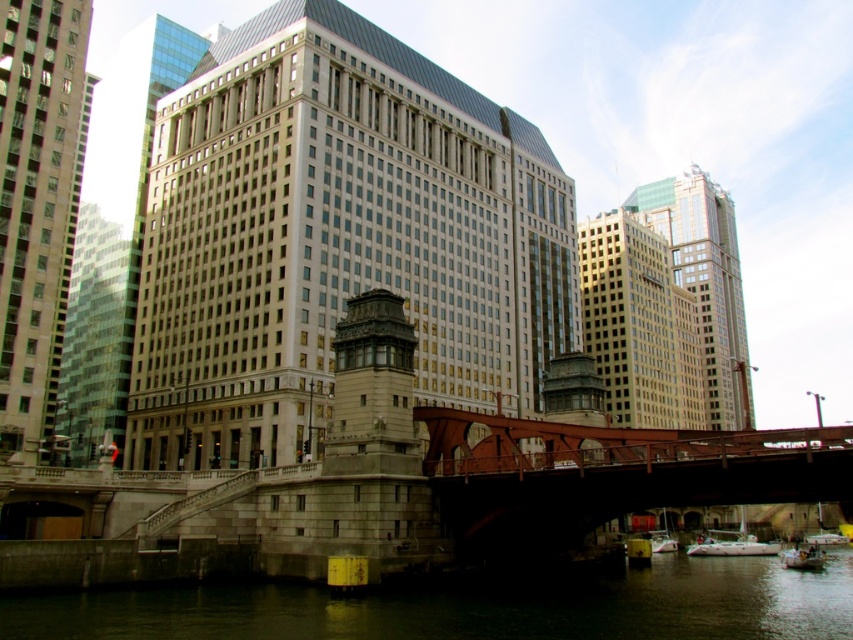
Question: Estimate the real-world distances between objects in this image. Which object is farther from the beige glass skyscraper at center?

Choices:
 (A) gold glass building at center-right
 (B) white plastic boat at lower right

Answer: (A)

Question: Can you confirm if greenish concrete water at lower center is positioned below white plastic boat at lower right?

Choices:
 (A) no
 (B) yes

Answer: (A)

Question: Which point is closer to the camera?

Choices:
 (A) (763, 547)
 (B) (848, 477)

Answer: (B)

Question: Which point appears farthest from the camera in this image?

Choices:
 (A) (239, 275)
 (B) (30, 266)
 (C) (682, 595)

Answer: (A)

Question: Can you confirm if beige glass skyscraper at center is bigger than white glossy sailboat at lower center?

Choices:
 (A) no
 (B) yes

Answer: (B)

Question: Can you confirm if rusty metal bridge at center is thinner than gold glass building at center-right?

Choices:
 (A) yes
 (B) no

Answer: (A)